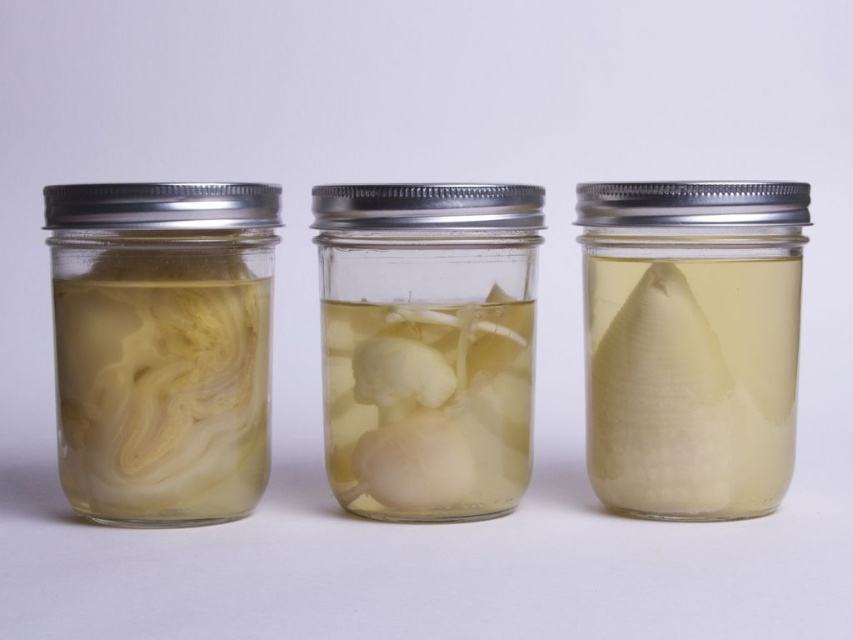
Between translucent glass cone at center and translucent white mushrooms at center, which one appears on the right side from the viewer's perspective?

From the viewer's perspective, translucent glass cone at center appears more on the right side.

Where is `translucent glass cone at center`? The width and height of the screenshot is (853, 640). translucent glass cone at center is located at coordinates (691, 342).

Image resolution: width=853 pixels, height=640 pixels. I want to click on translucent glass cone at center, so click(691, 342).

Does translucent glass cone at center have a larger size compared to white glossy noodles at left?

Yes, translucent glass cone at center is bigger than white glossy noodles at left.

Is translucent glass cone at center further to the viewer compared to white glossy noodles at left?

Yes, translucent glass cone at center is behind white glossy noodles at left.

Where is `translucent glass cone at center`? The width and height of the screenshot is (853, 640). translucent glass cone at center is located at coordinates (691, 342).

Who is taller, white glossy noodles at left or translucent white mushrooms at center?

With more height is white glossy noodles at left.

Does white glossy noodles at left appear on the left side of translucent white mushrooms at center?

Yes, white glossy noodles at left is to the left of translucent white mushrooms at center.

Is point (148, 378) positioned after point (463, 317)?

No, (148, 378) is in front of (463, 317).

Image resolution: width=853 pixels, height=640 pixels. What are the coordinates of `white glossy noodles at left` in the screenshot? It's located at (161, 385).